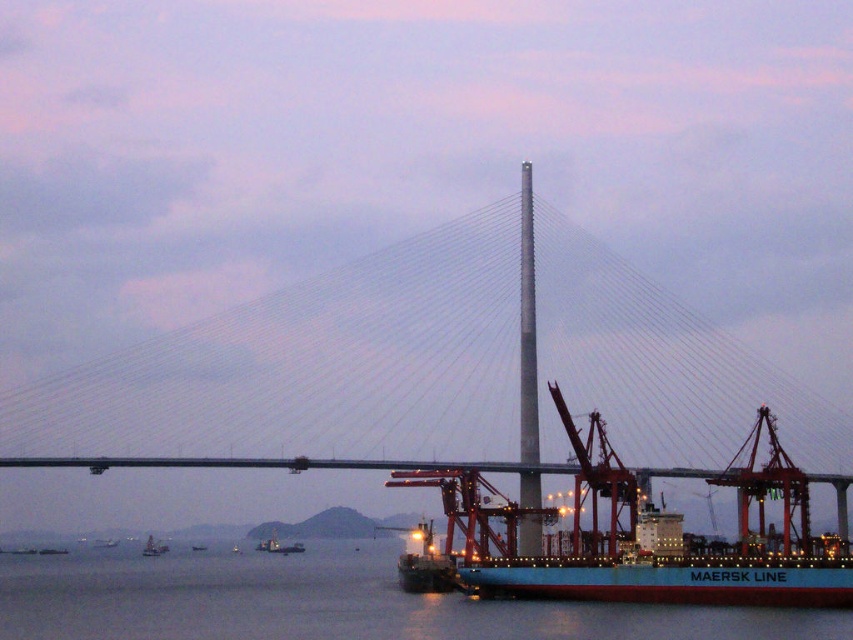
You are a harbor pilot tasked with guiding a new cargo ship into the port. You observe the metallic gray boat at lower left and the metallic blue container ship at lower center. What is the minimum safe distance you should maintain between them to avoid collision?

The minimum safe distance to avoid collision between the metallic gray boat at lower left and the metallic blue container ship at lower center should be at least 23.20 meters, as they are currently 23.20 meters apart.

You are a photographer planning to capture the harbor scene. You want to ensure that the blue water at lower center and the teal matte container ship at center are both visible in your shot. Based on their sizes, which object should you prioritize framing closer to the edge of the photo to avoid overcrowding?

The teal matte container ship at center should be framed closer to the edge since the blue water at lower center is wider, so placing the smaller ship near the edge allows both elements to fit without overcrowding.

You are a crane operator on the teal matte container ship at center. You need to lower a heavy crate onto the blue water at lower center. Is this possible? Explain why or why not based on the scene description.

The blue water at lower center is positioned under the teal matte container ship at center, meaning the water is directly beneath the ship. However, the scene description mentions the ship is docked, so the water beneath it is part of the harbor where the ship is anchored. Lowering a crate onto the water here would be possible as the water is present beneath the ship.